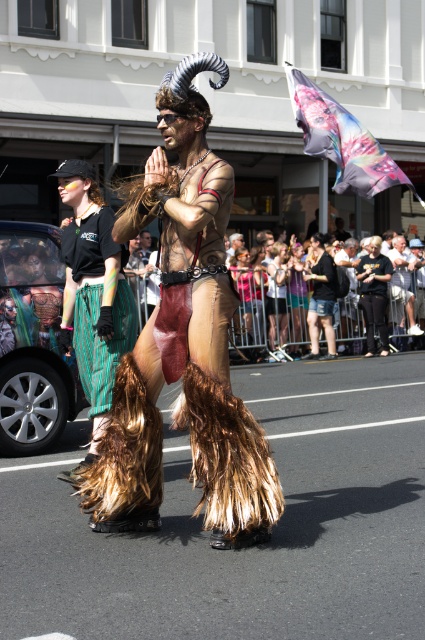
You are standing at the camera position and want to throw a small object to either the point at (x=85, y=292) or the point at (x=393, y=250). Which point is closer to you?

Point at (x=85, y=292) is closer to you than point at (x=393, y=250).

You are standing at the parade and want to know how far the point at coordinates (99, 260) is from you. Can you determine the distance?

The point at coordinates (99, 260) is 22.17 feet away from you.

Based on the scene description, where is the green striped pants at left located in terms of coordinates?

The green striped pants at left is located at coordinates point (98, 305).